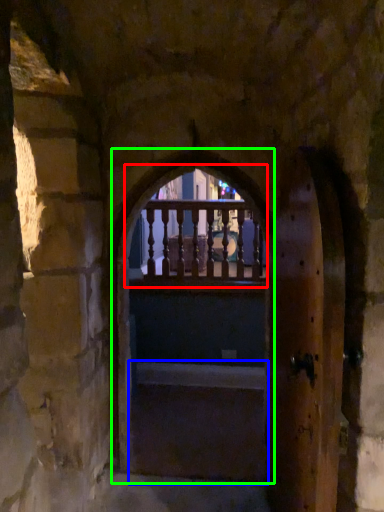
Question: Which object is the farthest from glass window (highlighted by a red box)? Choose among these: stairs (highlighted by a blue box) or window frame (highlighted by a green box).

Choices:
 (A) stairs
 (B) window frame

Answer: (A)